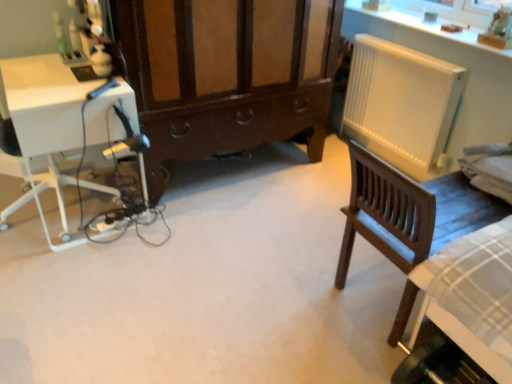
Question: Is dark wood chair at right positioned with its back to white plastic radiator at right?

Choices:
 (A) no
 (B) yes

Answer: (A)

Question: Is dark wood chair at right wider than white plastic radiator at right?

Choices:
 (A) yes
 (B) no

Answer: (A)

Question: Is dark wood chair at right not close to white plastic radiator at right?

Choices:
 (A) yes
 (B) no

Answer: (B)

Question: Is dark wood chair at right further to the viewer compared to white plastic radiator at right?

Choices:
 (A) no
 (B) yes

Answer: (A)

Question: Is dark wood chair at right positioned before white plastic radiator at right?

Choices:
 (A) no
 (B) yes

Answer: (B)

Question: From the image's perspective, would you say dark wood chair at right is positioned over white plastic radiator at right?

Choices:
 (A) no
 (B) yes

Answer: (A)

Question: From the image's perspective, is white plastic radiator at right above dark wood chair at right?

Choices:
 (A) yes
 (B) no

Answer: (A)

Question: Is white plastic radiator at right to the right of dark wood chair at right from the viewer's perspective?

Choices:
 (A) no
 (B) yes

Answer: (A)

Question: From a real-world perspective, is white plastic radiator at right over dark wood chair at right?

Choices:
 (A) yes
 (B) no

Answer: (A)

Question: Does white plastic radiator at right come behind dark wood chair at right?

Choices:
 (A) no
 (B) yes

Answer: (B)

Question: Is white plastic radiator at right positioned before dark wood chair at right?

Choices:
 (A) no
 (B) yes

Answer: (A)

Question: Considering the relative positions of white plastic radiator at right and dark wood chair at right in the image provided, is white plastic radiator at right to the left of dark wood chair at right from the viewer's perspective?

Choices:
 (A) yes
 (B) no

Answer: (A)

Question: Are brown wood cabinet at center and white plastic radiator at right located far from each other?

Choices:
 (A) yes
 (B) no

Answer: (B)